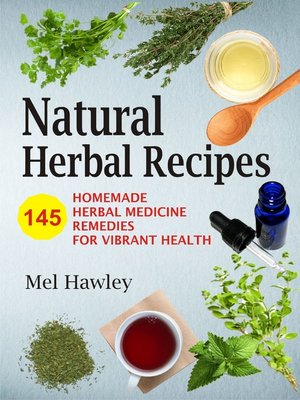
Identify the location of mug. This screenshot has width=300, height=400. (151, 378).